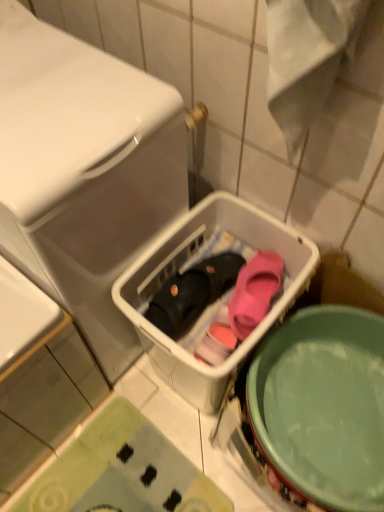
Question: In terms of height, does pink matte slipper at center, the second footwear from the left, look taller or shorter compared to white plastic basket at center, the 1th dish washer when ordered from right to left?

Choices:
 (A) short
 (B) tall

Answer: (A)

Question: Considering the positions of point (256, 266) and point (289, 306), is point (256, 266) closer or farther from the camera than point (289, 306)?

Choices:
 (A) closer
 (B) farther

Answer: (B)

Question: Considering the real-world distances, which object is farthest from the white plastic basket at center, which ranks as the second dish washer in left-to-right order?

Choices:
 (A) green textured bath mat at lower left
 (B) white glossy dishwasher at upper left, which is counted as the 2th dish washer, starting from the right
 (C) black matte slipper at center, which is the 1th footwear in left-to-right order
 (D) green matte mixing bowl at lower right
 (E) pink matte slipper at center, the second footwear from the left

Answer: (A)

Question: Which object is positioned farthest from the black matte slipper at center, the second footwear positioned from the right?

Choices:
 (A) green matte mixing bowl at lower right
 (B) pink matte slipper at center, the second footwear from the left
 (C) white plastic basket at center, the 1th dish washer when ordered from right to left
 (D) green textured bath mat at lower left
 (E) white glossy dishwasher at upper left, which is counted as the 2th dish washer, starting from the right

Answer: (D)